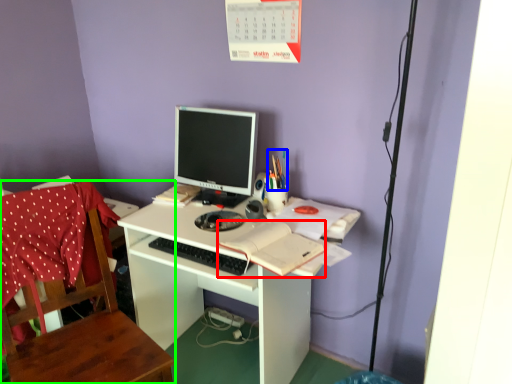
Question: Considering the real-world distances, which object is farthest from notebook (highlighted by a red box)? stationery (highlighted by a blue box) or chair (highlighted by a green box)?

Choices:
 (A) stationery
 (B) chair

Answer: (B)